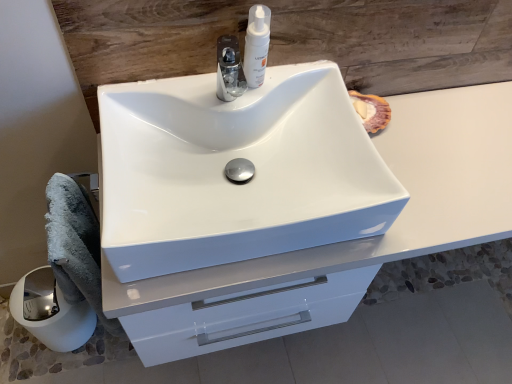
At what (x,y) coordinates should I click in order to perform the action: click on free space that is to the left of white glossy pump at upper center. Please return your answer as a coordinate pair (x, y). Looking at the image, I should click on (197, 91).